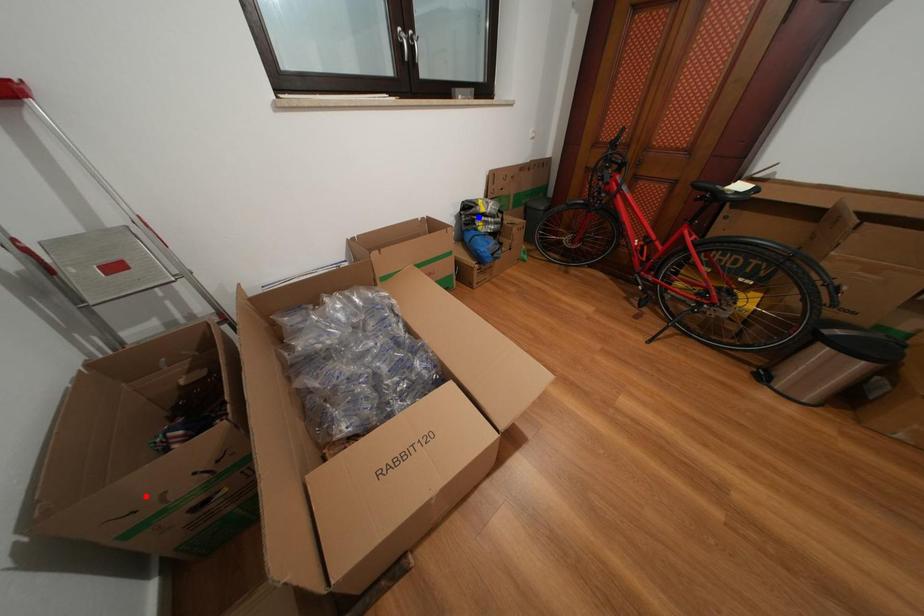
Question: Which of the two points in the image is closer to the camera?

Choices:
 (A) Blue point is closer.
 (B) Red point is closer.

Answer: (B)